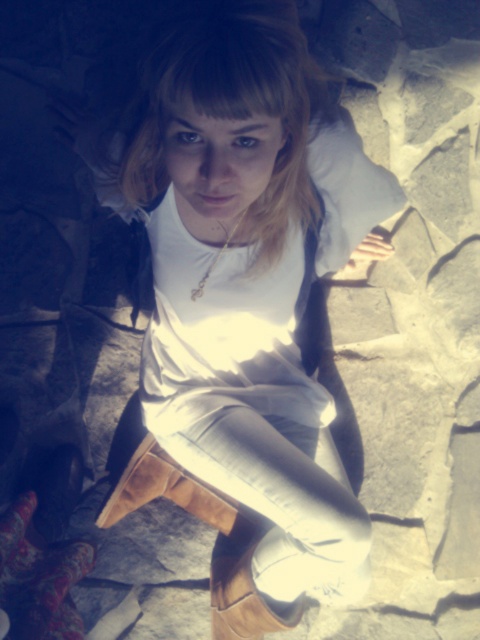
Question: Observing the image, what is the correct spatial positioning of white leather boots at center in reference to gold chain necklace at center?

Choices:
 (A) left
 (B) right

Answer: (B)

Question: In this image, where is white leather boots at center located relative to gold chain necklace at center?

Choices:
 (A) above
 (B) below

Answer: (B)

Question: Which object is farther from the camera taking this photo?

Choices:
 (A) white leather boots at center
 (B) gold chain necklace at center

Answer: (B)

Question: Is the position of white leather boots at center less distant than that of gold chain necklace at center?

Choices:
 (A) no
 (B) yes

Answer: (B)

Question: Which point is farther to the camera?

Choices:
 (A) white leather boots at center
 (B) gold chain necklace at center

Answer: (B)